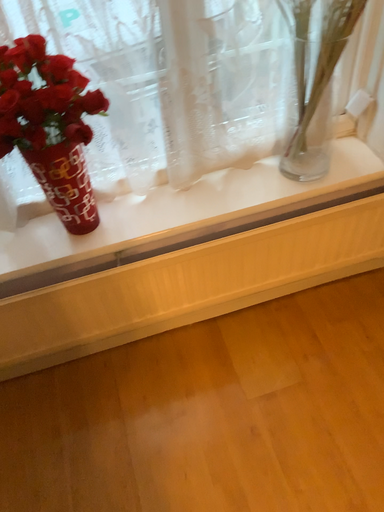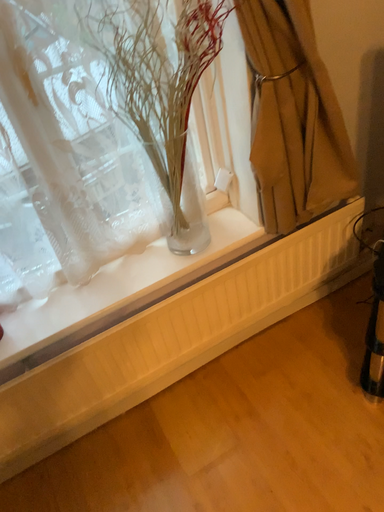
Question: Which way did the camera rotate in the video?

Choices:
 (A) rotated upward
 (B) rotated downward

Answer: (A)